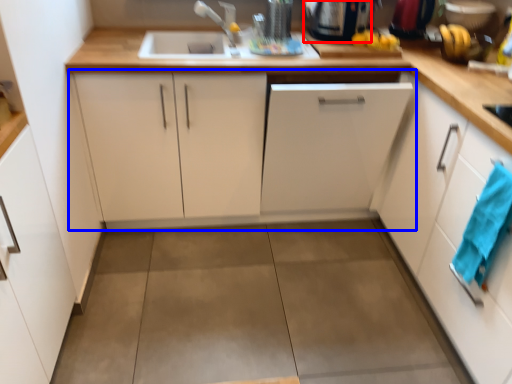
Question: Which object is closer to the camera taking this photo, appliance (highlighted by a red box) or cabinetry (highlighted by a blue box)?

Choices:
 (A) appliance
 (B) cabinetry

Answer: (B)